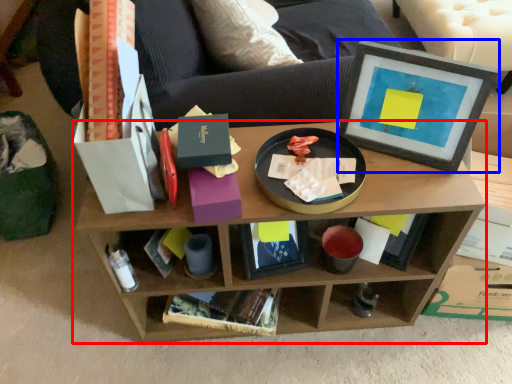
Question: Which object is further to the camera taking this photo, shelf (highlighted by a red box) or picture frame (highlighted by a blue box)?

Choices:
 (A) shelf
 (B) picture frame

Answer: (A)